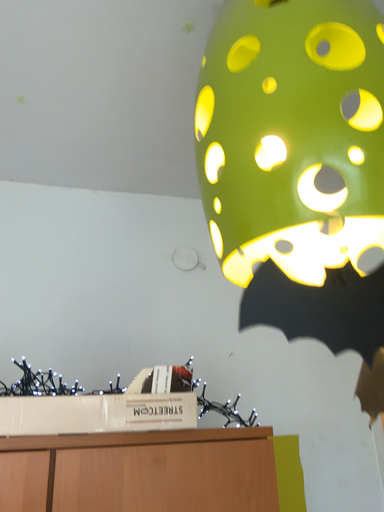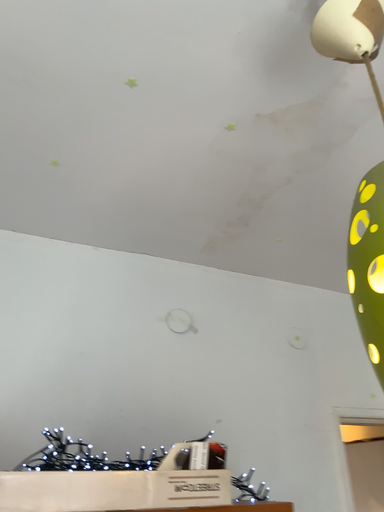
Question: How did the camera likely rotate when shooting the video?

Choices:
 (A) rotated right
 (B) rotated left

Answer: (A)